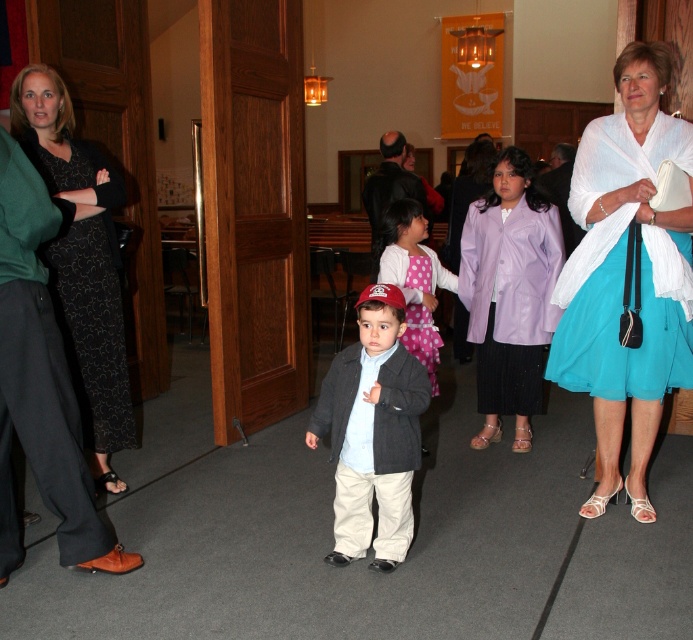
Question: Estimate the real-world distances between objects in this image. Which object is farther from the black printed fabric dress at left?

Choices:
 (A) matte gray jacket at center
 (B) lavender satin blazer at center
 (C) pink polka dot dress at center

Answer: (B)

Question: Which of the following is the farthest from the observer?

Choices:
 (A) (96, 433)
 (B) (435, 396)

Answer: (B)

Question: Can you confirm if matte gray jacket at center is thinner than pink polka dot dress at center?

Choices:
 (A) yes
 (B) no

Answer: (B)

Question: Where is lavender satin blazer at center located in relation to black printed fabric dress at left in the image?

Choices:
 (A) left
 (B) right

Answer: (B)

Question: Can you confirm if white textured shawl at upper right is smaller than matte gray jacket at center?

Choices:
 (A) yes
 (B) no

Answer: (B)

Question: Which is nearer to the white textured shawl at upper right?

Choices:
 (A) pink polka dot dress at center
 (B) black printed fabric dress at left
 (C) lavender satin blazer at center
 (D) matte gray jacket at center

Answer: (C)